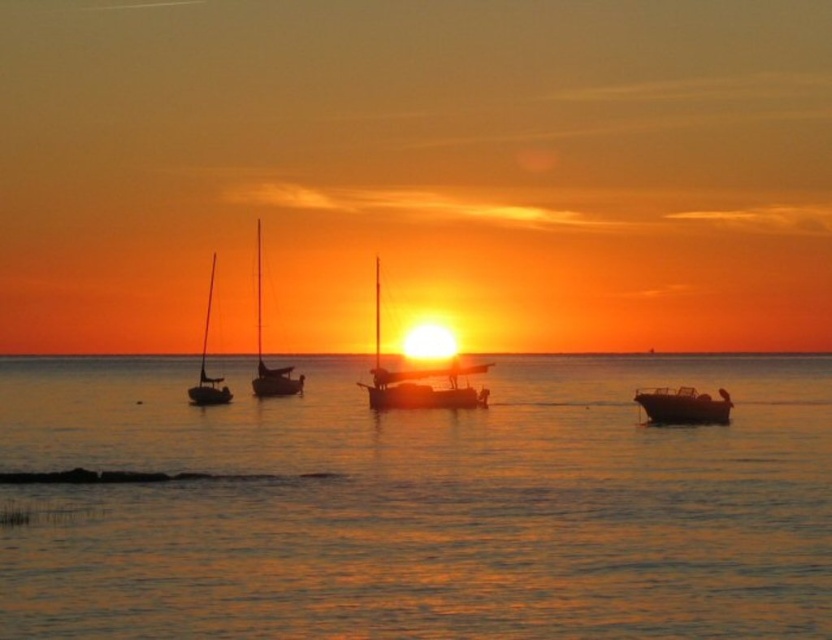
Question: Which point is closer to the camera?

Choices:
 (A) (285, 376)
 (B) (121, 612)
 (C) (488, 353)
 (D) (202, 401)

Answer: (B)

Question: Considering the relative positions of silvery metallic sailboat at center and satin black sailboat at left in the image provided, where is silvery metallic sailboat at center located with respect to satin black sailboat at left?

Choices:
 (A) right
 (B) left

Answer: (A)

Question: Which of these objects is positioned closest to the satin black sailboat at left?

Choices:
 (A) orange matte horizon at center
 (B) smooth water at center

Answer: (B)

Question: Does smooth water at center appear on the left side of silvery metallic sailboat at center?

Choices:
 (A) yes
 (B) no

Answer: (A)

Question: Does smooth water at center have a lesser width compared to metallic sailboat at center?

Choices:
 (A) no
 (B) yes

Answer: (A)

Question: Considering the real-world distances, which object is closest to the orange matte horizon at center?

Choices:
 (A) metallic silver boat at right
 (B) satin black sailboat at center

Answer: (B)